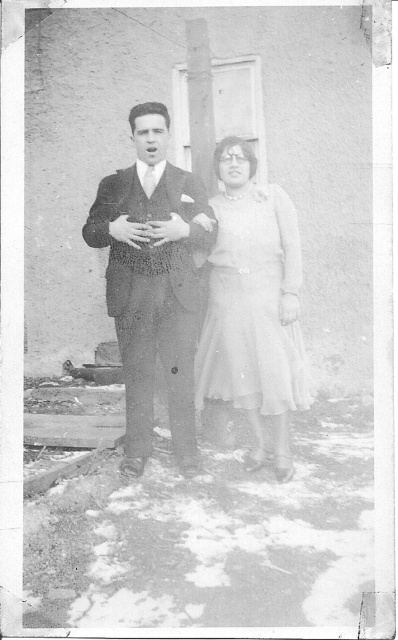
Question: Which of the following is the closest to the observer?

Choices:
 (A) smooth dark suit at center
 (B) white sheer dress at center

Answer: (A)

Question: Is smooth dark suit at center above white sheer dress at center?

Choices:
 (A) yes
 (B) no

Answer: (A)

Question: Which point appears farthest from the camera in this image?

Choices:
 (A) (243, 364)
 (B) (128, 196)

Answer: (A)

Question: Which of the following is the farthest from the observer?

Choices:
 (A) smooth dark suit at center
 (B) white sheer dress at center

Answer: (B)

Question: Is smooth dark suit at center behind white sheer dress at center?

Choices:
 (A) no
 (B) yes

Answer: (A)

Question: Is smooth dark suit at center to the right of white sheer dress at center from the viewer's perspective?

Choices:
 (A) yes
 (B) no

Answer: (B)